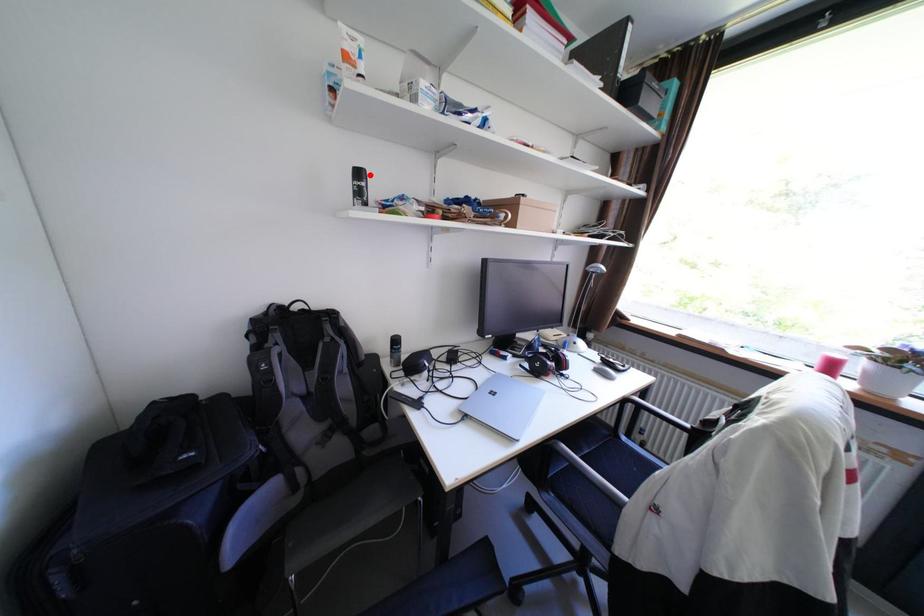
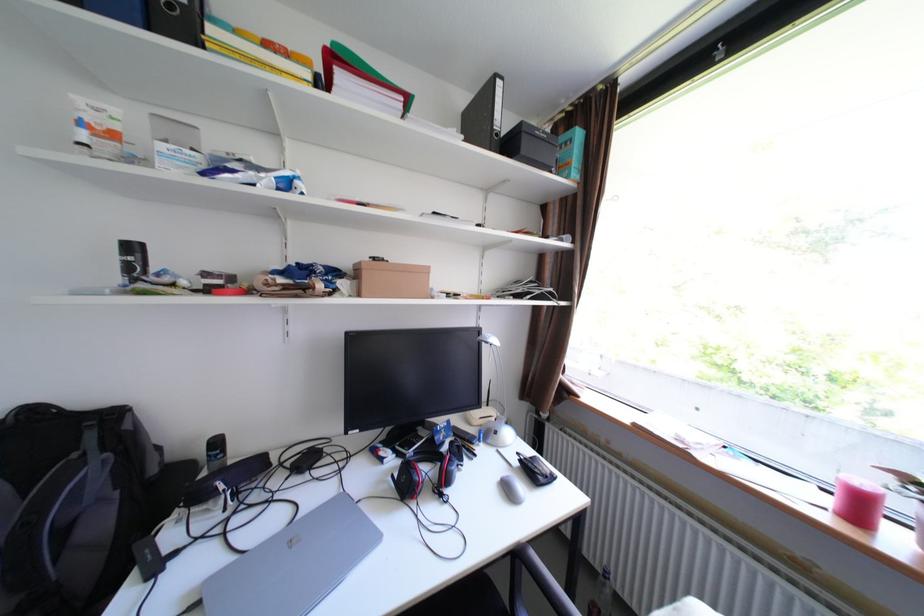
Locate, in the second image, the point that corresponds to the highlighted location in the first image.

(143, 248)